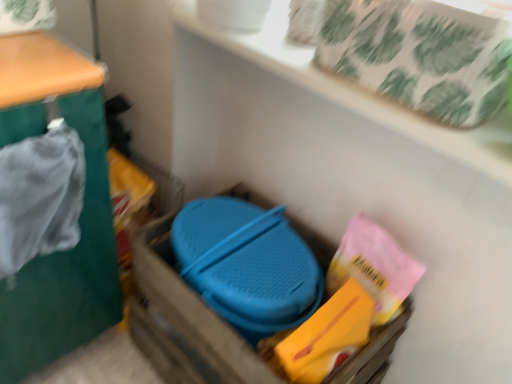
Question: Can you confirm if blue plastic container at center is bigger than green fabric at left?

Choices:
 (A) no
 (B) yes

Answer: (A)

Question: Considering the relative sizes of blue plastic container at center and green fabric at left in the image provided, is blue plastic container at center wider than green fabric at left?

Choices:
 (A) yes
 (B) no

Answer: (B)

Question: From a real-world perspective, is blue plastic container at center positioned over green fabric at left based on gravity?

Choices:
 (A) yes
 (B) no

Answer: (B)

Question: Does blue plastic container at center turn towards green fabric at left?

Choices:
 (A) yes
 (B) no

Answer: (B)

Question: Is blue plastic container at center far away from green fabric at left?

Choices:
 (A) no
 (B) yes

Answer: (A)

Question: In the image, is white textured tray at upper center positioned in front of or behind green fabric at left?

Choices:
 (A) front
 (B) behind

Answer: (B)

Question: Is point [490, 155] positioned closer to the camera than point [65, 69]?

Choices:
 (A) farther
 (B) closer

Answer: (B)

Question: Considering the relative positions of white textured tray at upper center and green fabric at left in the image provided, is white textured tray at upper center to the left or to the right of green fabric at left?

Choices:
 (A) left
 (B) right

Answer: (B)

Question: In terms of size, does white textured tray at upper center appear bigger or smaller than green fabric at left?

Choices:
 (A) big
 (B) small

Answer: (B)

Question: From a real-world perspective, is green fabric at left positioned above or below white textured tray at upper center?

Choices:
 (A) below
 (B) above

Answer: (A)

Question: Is point (83, 228) positioned closer to the camera than point (371, 97)?

Choices:
 (A) closer
 (B) farther

Answer: (B)

Question: Considering their positions, is green fabric at left located in front of or behind white textured tray at upper center?

Choices:
 (A) behind
 (B) front

Answer: (B)

Question: From their relative heights in the image, would you say green fabric at left is taller or shorter than white textured tray at upper center?

Choices:
 (A) tall
 (B) short

Answer: (A)

Question: Is white textured tray at upper center bigger or smaller than blue plastic container at center?

Choices:
 (A) small
 (B) big

Answer: (A)

Question: From the image's perspective, is white textured tray at upper center located above or below blue plastic container at center?

Choices:
 (A) below
 (B) above

Answer: (B)